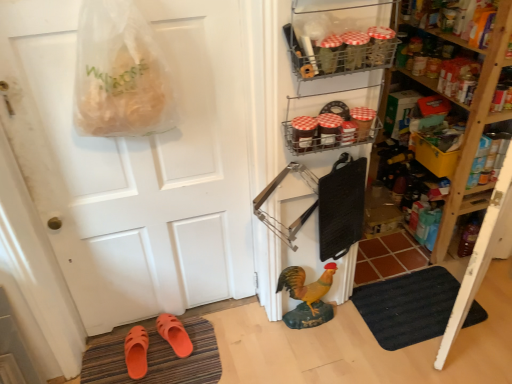
Find the location of `vacant area that lies between black rubber doormat at lower right, placed as the 2th doormat when sorted from left to right, and orange rubber doormat at lower left, arranged as the first doormat when viewed from the left`. vacant area that lies between black rubber doormat at lower right, placed as the 2th doormat when sorted from left to right, and orange rubber doormat at lower left, arranged as the first doormat when viewed from the left is located at coordinates (279, 342).